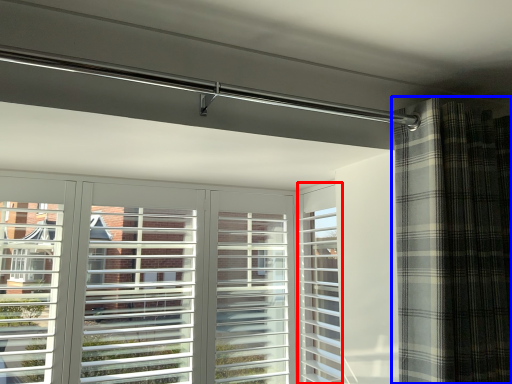
Question: Which object appears closest to the camera in this image, screen door (highlighted by a red box) or curtain (highlighted by a blue box)?

Choices:
 (A) screen door
 (B) curtain

Answer: (B)